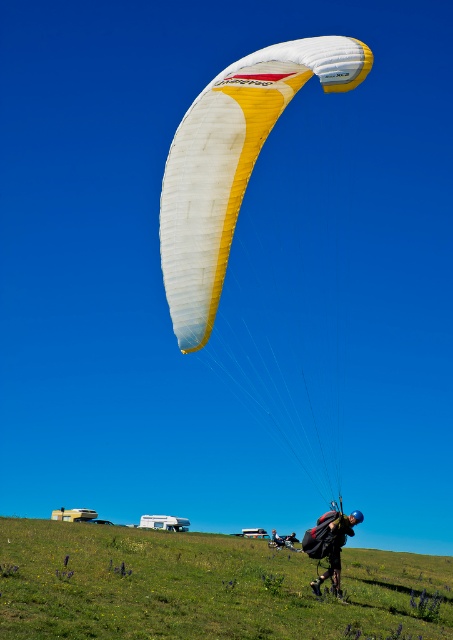
Based on the coordinates provided in the scene description, where is the green grassy field at lower center located?

The green grassy field at lower center is located at coordinates point (x=202, y=588).

You are a photographer trying to capture the entire scene of the green grassy field at lower center and the dark blue fabric parachute at upper center in one shot. Based on their heights, which object should you focus on first to ensure both are in frame?

The green grassy field at lower center has a greater height compared to the dark blue fabric parachute at upper center. To capture both in one shot, focus on the green grassy field at lower center first as it is taller and occupies more vertical space, ensuring the parachute will naturally fit within the frame.